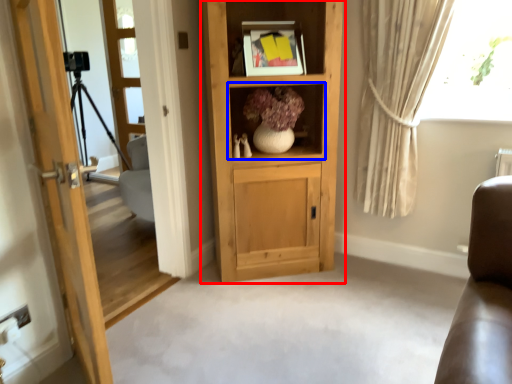
Question: Which object appears closest to the camera in this image, cabinetry (highlighted by a red box) or shelf (highlighted by a blue box)?

Choices:
 (A) cabinetry
 (B) shelf

Answer: (A)